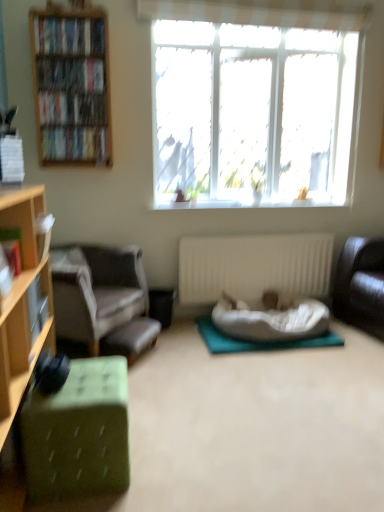
Where is `free spot above green fabric ottoman at lower left (from a real-world perspective)`? This screenshot has height=512, width=384. free spot above green fabric ottoman at lower left (from a real-world perspective) is located at coordinates (74, 379).